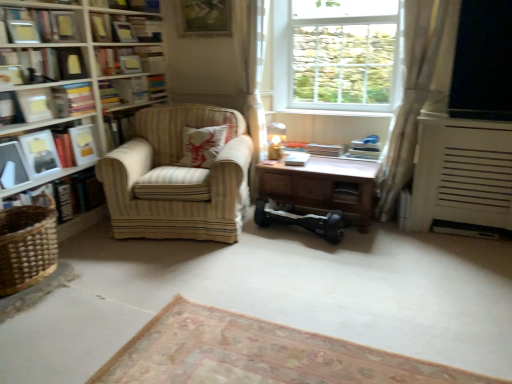
This screenshot has height=384, width=512. In order to click on hardcover book at left, the 3th book from the right in this screenshot , I will do `click(73, 99)`.

Locate an element on the screen. This screenshot has height=384, width=512. white wooden window at upper center is located at coordinates (338, 55).

Identify the location of striped fabric armchair at left. This screenshot has width=512, height=384. (177, 178).

Image resolution: width=512 pixels, height=384 pixels. What do you see at coordinates (47, 63) in the screenshot?
I see `matte black book at upper left, which ranks as the 6th book in right-to-left order` at bounding box center [47, 63].

At what (x,y) coordinates should I click in order to perform the action: click on hardcover book at left, the 3th book from the right. Please return your answer as a coordinate pair (x, y). Looking at the image, I should click on (73, 99).

Which object is wider, white checkered curtain at center, positioned as the 2th curtain in right-to-left order, or wooden bookshelf at left?

Wider between the two is wooden bookshelf at left.

Considering the relative sizes of white checkered curtain at center, the first curtain positioned from the left, and wooden bookshelf at left in the image provided, is white checkered curtain at center, the first curtain positioned from the left, taller than wooden bookshelf at left?

No, white checkered curtain at center, the first curtain positioned from the left, is not taller than wooden bookshelf at left.

From the wooden bookshelf at left, count 1st curtain to the right and point to it. Please provide its 2D coordinates.

[(252, 73)]

Is wooden bookshelf at left inside wooden picture frame at upper center?

No, wooden bookshelf at left is not inside wooden picture frame at upper center.

Which is behind, wooden picture frame at upper center or wooden bookshelf at left?

wooden picture frame at upper center is further away from the camera.

Based on their sizes in the image, would you say wooden picture frame at upper center is bigger or smaller than wooden bookshelf at left?

Clearly, wooden picture frame at upper center is smaller in size than wooden bookshelf at left.

Can you confirm if wooden picture frame at upper center is thinner than wooden bookshelf at left?

Yes.

Where is `window above the hardcover book at center, which is counted as the third paperback book, starting from the left (from the image's perspective)`? This screenshot has width=512, height=384. window above the hardcover book at center, which is counted as the third paperback book, starting from the left (from the image's perspective) is located at coordinates (338, 55).

Does white wooden window at upper center appear on the left side of hardcover book at center, which is counted as the third paperback book, starting from the left?

No.

From the image's perspective, is white wooden window at upper center above or below hardcover book at center, marked as the first paperback book in a right-to-left arrangement?

Clearly, from the image's perspective, white wooden window at upper center is above hardcover book at center, marked as the first paperback book in a right-to-left arrangement.

Based on the photo, does white wooden window at upper center have a greater width compared to hardcover book at center, marked as the first paperback book in a right-to-left arrangement?

No, white wooden window at upper center is not wider than hardcover book at center, marked as the first paperback book in a right-to-left arrangement.

From the image's perspective, which is below, wooden bookshelf at left or wooden picture frame at upper center?

wooden bookshelf at left, from the image's perspective.

Does wooden bookshelf at left appear on the right side of wooden picture frame at upper center?

In fact, wooden bookshelf at left is to the left of wooden picture frame at upper center.

The width and height of the screenshot is (512, 384). I want to click on picture frame above the wooden bookshelf at left (from a real-world perspective), so click(x=204, y=18).

What's the angular difference between wooden bookshelf at left and wooden picture frame at upper center's facing directions?

91.6 degrees separate the facing orientations of wooden bookshelf at left and wooden picture frame at upper center.

How different are the orientations of matte black book at upper left, which ranks as the 6th book in right-to-left order, and hardcover book at upper left, placed as the 2th book when sorted from right to left, in degrees?

The facing directions of matte black book at upper left, which ranks as the 6th book in right-to-left order, and hardcover book at upper left, placed as the 2th book when sorted from right to left, are 0.534 degrees apart.

Does matte black book at upper left, which appears as the second book when viewed from the left, appear on the left side of hardcover book at upper left, which appears as the sixth book when viewed from the left?

Yes.

Could you measure the distance between matte black book at upper left, which appears as the second book when viewed from the left, and hardcover book at upper left, placed as the 2th book when sorted from right to left?

19.63 inches.

Is matte black book at upper left, which ranks as the 6th book in right-to-left order, not close to hardcover book at upper left, placed as the 2th book when sorted from right to left?

No, matte black book at upper left, which ranks as the 6th book in right-to-left order, is not far away from hardcover book at upper left, placed as the 2th book when sorted from right to left.

How many degrees apart are the facing directions of woven brown basket at lower left and hardcover book at left, arranged as the 4th book when viewed from the left?

They differ by 2.6 degrees in their facing directions.

Find the location of a particular element. The width and height of the screenshot is (512, 384). book that is the 2nd object located above the woven brown basket at lower left (from the image's perspective) is located at coordinates (64, 149).

Does woven brown basket at lower left turn towards hardcover book at left, which is the fourth book from right to left?

No, woven brown basket at lower left is not aimed at hardcover book at left, which is the fourth book from right to left.

Is woven brown basket at lower left directly adjacent to hardcover book at left, arranged as the 4th book when viewed from the left?

No.

Looking at this image, which of these two, white wooden window at upper center or matte black photo frame at left, the 1th paperback book viewed from the left, is wider?

With larger width is white wooden window at upper center.

Which point is more forward, (x=343, y=105) or (x=50, y=139)?

Positioned in front is point (x=50, y=139).

Can you tell me how much white wooden window at upper center and matte black photo frame at left, which is the third paperback book in right-to-left order, differ in facing direction?

white wooden window at upper center and matte black photo frame at left, which is the third paperback book in right-to-left order, are facing 90.4 degrees away from each other.

Who is bigger, white wooden window at upper center or matte black photo frame at left, which is the third paperback book in right-to-left order?

white wooden window at upper center.

Find the location of a particular element. This screenshot has width=512, height=384. shelf below the white checkered curtain at center, positioned as the 2th curtain in right-to-left order (from the image's perspective) is located at coordinates (82, 63).

You are a GUI agent. You are given a task and a screenshot of the screen. Output one action in this format:
    pyautogui.click(x=<x>, y=<y>)
    Task: Click on the picture frame above the wooden bookshelf at left (from a real-world perspective)
    The width and height of the screenshot is (512, 384).
    Given the screenshot: What is the action you would take?
    pyautogui.click(x=204, y=18)

Which object lies nearer to the anchor point carpeted floor at lower center, arranged as the first plain when viewed from the back, wooden at upper center or hardcover book at left, the 3th book from the right?

Based on the image, hardcover book at left, the 3th book from the right, appears to be nearer to carpeted floor at lower center, arranged as the first plain when viewed from the back.

When comparing their distances from hardcover book at upper left, placed as the 2th book when sorted from right to left, does hardcover book at left, the 3th book from the right, or wooden bookshelf at left seem further?

hardcover book at left, the 3th book from the right, is further to hardcover book at upper left, placed as the 2th book when sorted from right to left.

Based on their spatial positions, is white checkered curtain at center, the first curtain positioned from the left, or wooden bookshelf at left closer to matte black photo frame at left, which is the third paperback book in right-to-left order?

wooden bookshelf at left is closer to matte black photo frame at left, which is the third paperback book in right-to-left order.

Which object lies nearer to the anchor point wooden picture frame at upper center, striped fabric armchair at left or matte white paperback book at left, which ranks as the second paperback book in left-to-right order?

striped fabric armchair at left is closer to wooden picture frame at upper center.

From the picture: When comparing their distances from hardcover book at upper left, which appears as the sixth book when viewed from the left, does woven brown basket at lower left or matte white paperback book at left, which ranks as the second paperback book in left-to-right order, seem further?

Based on the image, woven brown basket at lower left appears to be further to hardcover book at upper left, which appears as the sixth book when viewed from the left.

From the image, which object appears to be farther from hardcover book at upper left, placed as the 2th book when sorted from right to left, white sheer curtain at right, which is counted as the first curtain, starting from the right, or hardcover book at left, arranged as the 4th book when viewed from the left?

white sheer curtain at right, which is counted as the first curtain, starting from the right, lies further to hardcover book at upper left, placed as the 2th book when sorted from right to left, than the other object.

Estimate the real-world distances between objects in this image. Which object is further from wooden bookshelf at left, matte black photo frame at left, the 1th paperback book viewed from the left, or white sheer curtain at right, the second curtain positioned from the left?

Based on the image, white sheer curtain at right, the second curtain positioned from the left, appears to be further to wooden bookshelf at left.

Looking at the image, which one is located further to white sheer curtain at right, the second curtain positioned from the left, hardcover book at center, marked as the first paperback book in a right-to-left arrangement, or hardcover book at center, the 1th book positioned from the right?

Among the two, hardcover book at center, marked as the first paperback book in a right-to-left arrangement, is located further to white sheer curtain at right, the second curtain positioned from the left.

Locate an element on the screen. This screenshot has width=512, height=384. basket positioned between carpet at center, the second plain viewed from the back, and striped fabric armchair at left from near to far is located at coordinates [x=27, y=246].

I want to click on curtain situated between woven brown basket at lower left and white sheer curtain at right, the second curtain positioned from the left, from left to right, so click(252, 73).

Locate an element on the screen. basket between wooden bookshelf at left and carpeted floor at lower center, the 2th plain positioned from the front, from left to right is located at coordinates (27, 246).

This screenshot has width=512, height=384. Identify the location of shelf located between carpeted floor at lower center, the 2th plain positioned from the front, and white checkered curtain at center, the first curtain positioned from the left, in the depth direction. (82, 63).